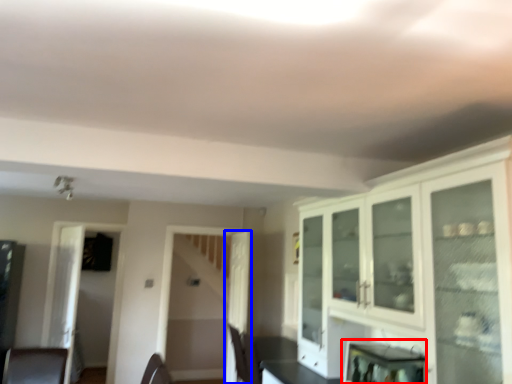
Question: Which object is closer to the camera taking this photo, appliance (highlighted by a red box) or door (highlighted by a blue box)?

Choices:
 (A) appliance
 (B) door

Answer: (A)